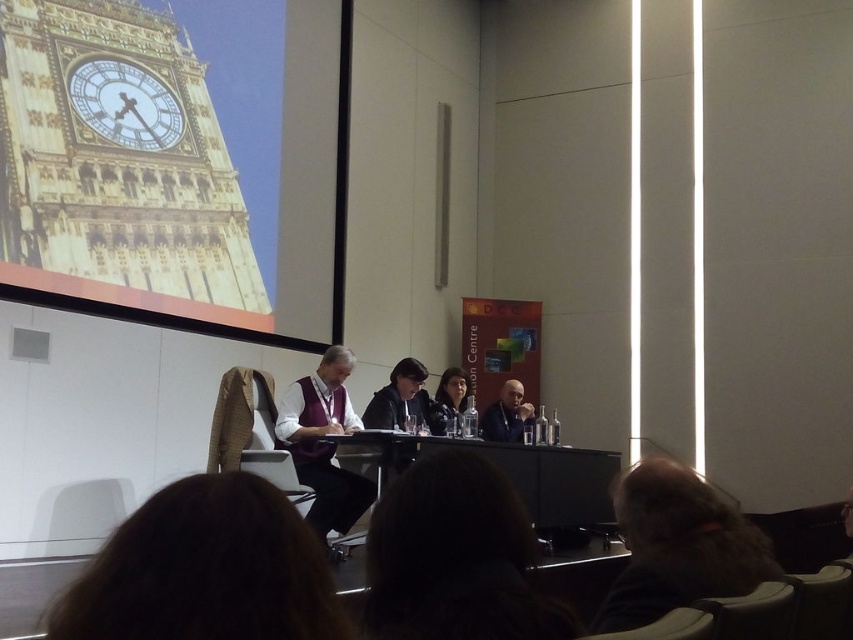
You are standing at the back of the conference room and want to take a photo of the dark brown hair at lower right. If your camera has a minimum focus distance of 4 feet, will you be able to capture it clearly?

The dark brown hair at lower right is 3.93 feet away from the camera, which is within the camera minimum focus distance of 4 feet. Therefore, you can capture it clearly.

You are attending a meeting and need to pass a note to the person with dark brown hair at lower right. Which direction should you move to reach them first, considering their positions relative to brown hair at lower center?

The brown hair at lower center is positioned on the left side of dark brown hair at lower right. To reach the dark brown hair at lower right, you should move to the right from the brown hair at lower center.

In the conference room scene, you notice the dark brown hair at lower right and the gold metallic clock at upper left. Which object takes up more visual space in the image?

The gold metallic clock at upper left takes up more visual space than the dark brown hair at lower right.